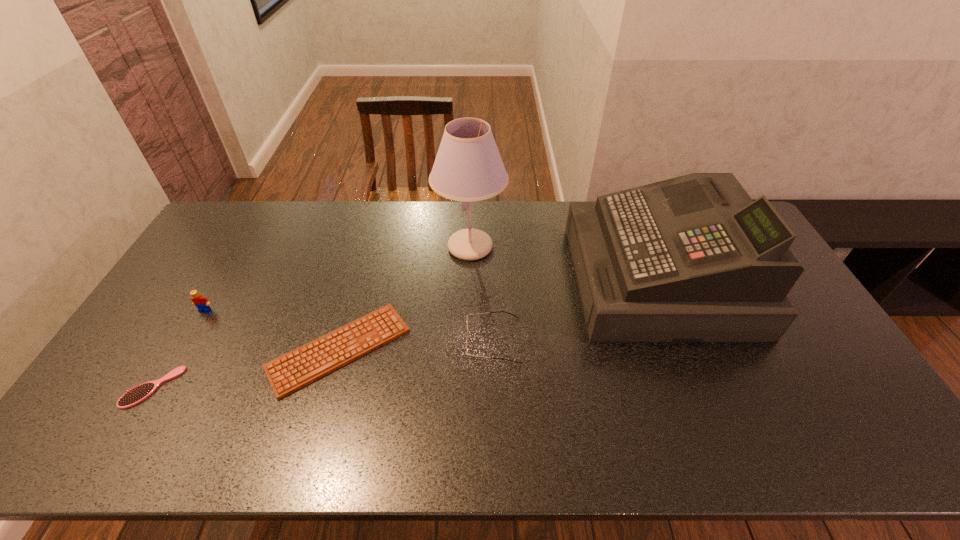
Locate an element on the screen. This screenshot has height=540, width=960. free space between the lampshade and the spectacles is located at coordinates (482, 294).

Locate an element on the screen. The image size is (960, 540). free spot between the rightmost object and the fourth object from right to left is located at coordinates (499, 314).

The width and height of the screenshot is (960, 540). In order to click on free space that is in between the Lego and the rightmost object in this screenshot , I will do `click(432, 294)`.

Where is `vacant point located between the rightmost object and the third object from left to right`? This screenshot has height=540, width=960. vacant point located between the rightmost object and the third object from left to right is located at coordinates (499, 314).

Where is `vacant space in between the tallest object and the hairbrush`? The image size is (960, 540). vacant space in between the tallest object and the hairbrush is located at coordinates (311, 317).

Where is `empty space between the lampshade and the fourth object from right to left`? The height and width of the screenshot is (540, 960). empty space between the lampshade and the fourth object from right to left is located at coordinates (405, 298).

Select which object is the fourth closest to the hairbrush. Please provide its 2D coordinates. Your answer should be formatted as a tuple, i.e. [(x, y)], where the tuple contains the x and y coordinates of a point satisfying the conditions above.

[(498, 311)]

Choose which object is the fourth nearest neighbor to the lampshade. Please provide its 2D coordinates. Your answer should be formatted as a tuple, i.e. [(x, y)], where the tuple contains the x and y coordinates of a point satisfying the conditions above.

[(202, 304)]

Locate an element on the screen. blank space that satisfies the following two spatial constraints: 1. on the front-facing side of the third tallest object; 2. on the right side of the computer keyboard is located at coordinates (182, 349).

The height and width of the screenshot is (540, 960). What are the coordinates of `free space that satisfies the following two spatial constraints: 1. on the front-facing side of the computer keyboard; 2. on the left side of the Lego` in the screenshot? It's located at (182, 349).